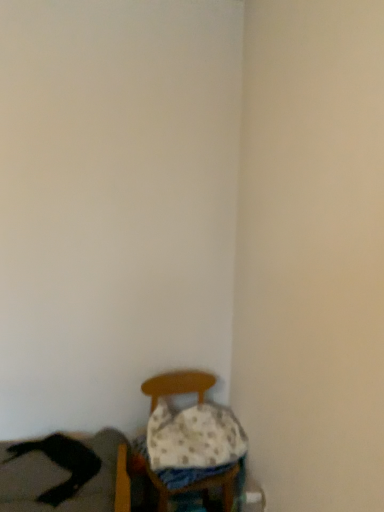
Question: From the image's perspective, is white dotted fabric pillow at lower center located above or below wooden chair at lower center?

Choices:
 (A) below
 (B) above

Answer: (B)

Question: Would you say white dotted fabric pillow at lower center is inside or outside wooden chair at lower center?

Choices:
 (A) inside
 (B) outside

Answer: (A)

Question: Which object is positioned farthest from the wooden chair at lower center?

Choices:
 (A) black leather couch at lower left
 (B) white dotted fabric pillow at lower center

Answer: (A)

Question: Estimate the real-world distances between objects in this image. Which object is closer to the white dotted fabric pillow at lower center?

Choices:
 (A) wooden chair at lower center
 (B) black leather couch at lower left

Answer: (A)